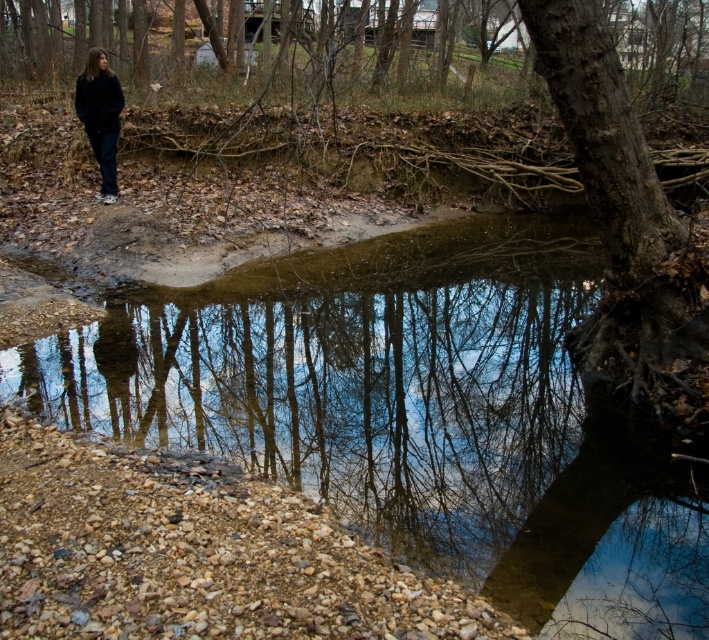
Question: Which point is closer to the camera?

Choices:
 (A) clear water at center
 (B) dark blue jeans at left

Answer: (A)

Question: Does clear water at center have a smaller size compared to dark blue jeans at left?

Choices:
 (A) yes
 (B) no

Answer: (A)

Question: In this image, where is clear water at center located relative to dark blue jeans at left?

Choices:
 (A) right
 (B) left

Answer: (A)

Question: Considering the relative positions of clear water at center and dark blue jeans at left in the image provided, where is clear water at center located with respect to dark blue jeans at left?

Choices:
 (A) above
 (B) below

Answer: (B)